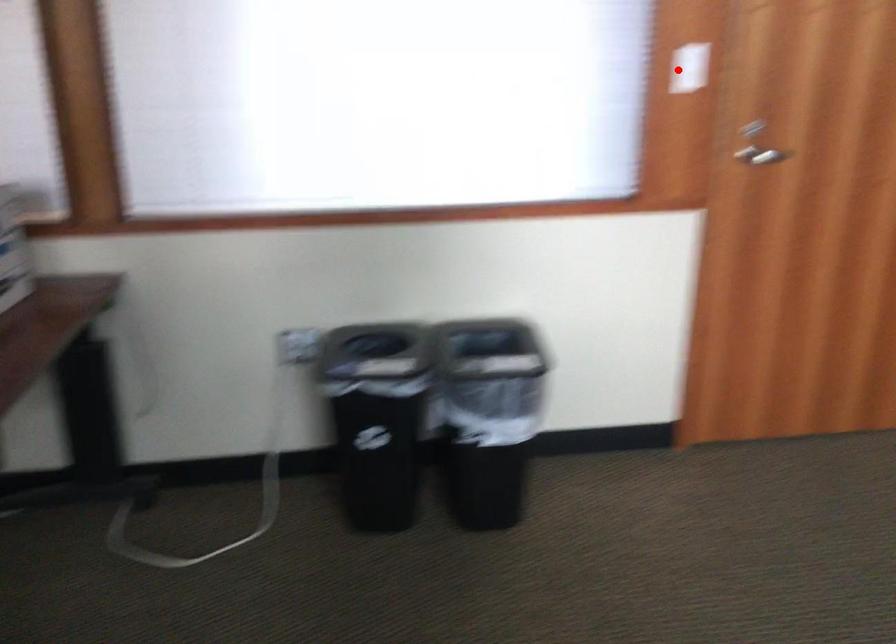
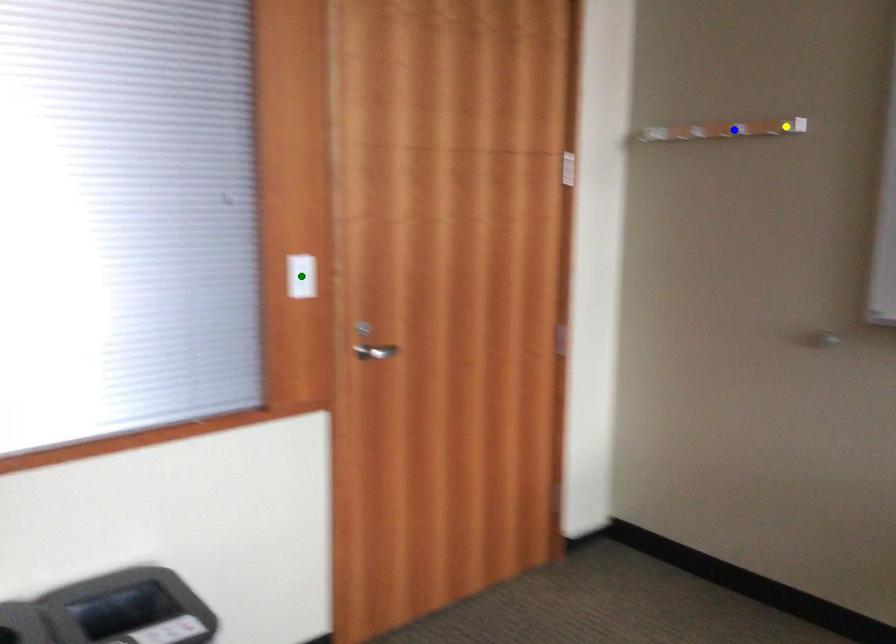
Question: I am providing you with two images of the same scene from different viewpoints. A red point is marked on the first image. You are given multiple points on the second image. Which point in image 2 represents the same 3d spot as the red point in image 1?

Choices:
 (A) yellow point
 (B) blue point
 (C) green point

Answer: (C)